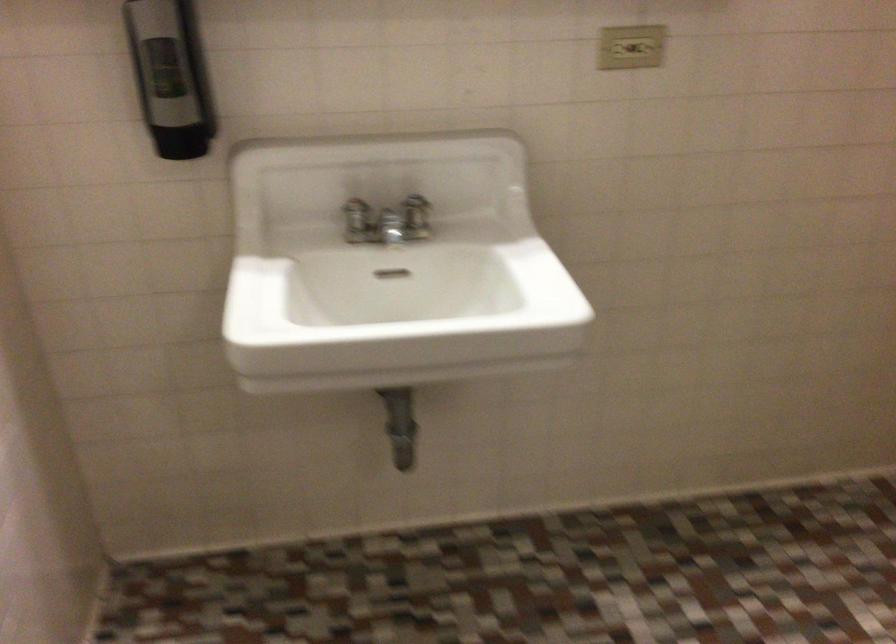
Identify the location of black dispenser lever. (169, 77).